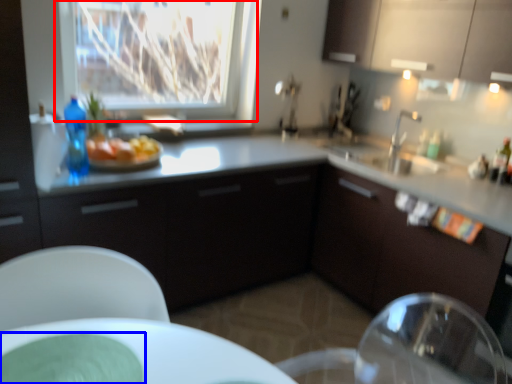
Question: Which object appears closest to the camera in this image, window (highlighted by a red box) or glass plate (highlighted by a blue box)?

Choices:
 (A) window
 (B) glass plate

Answer: (B)